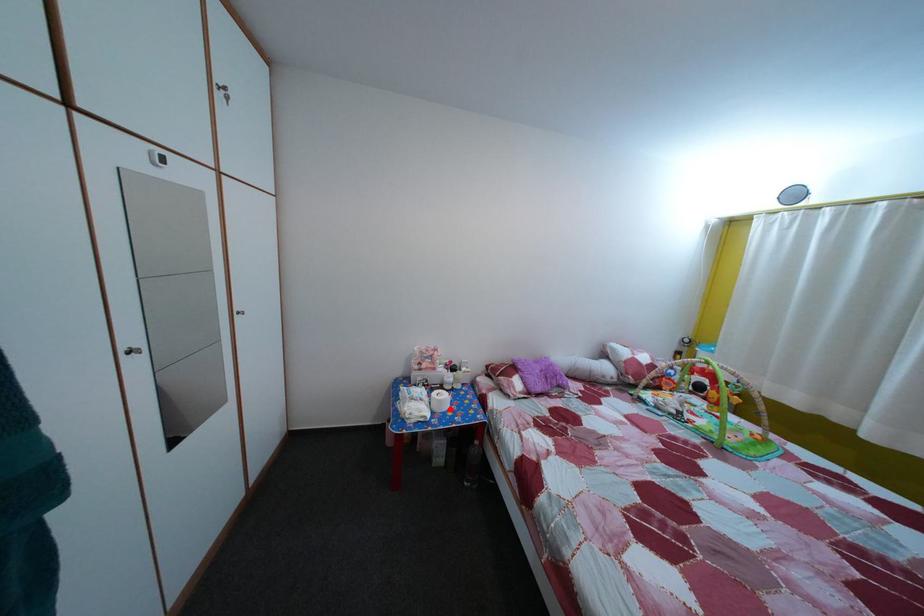
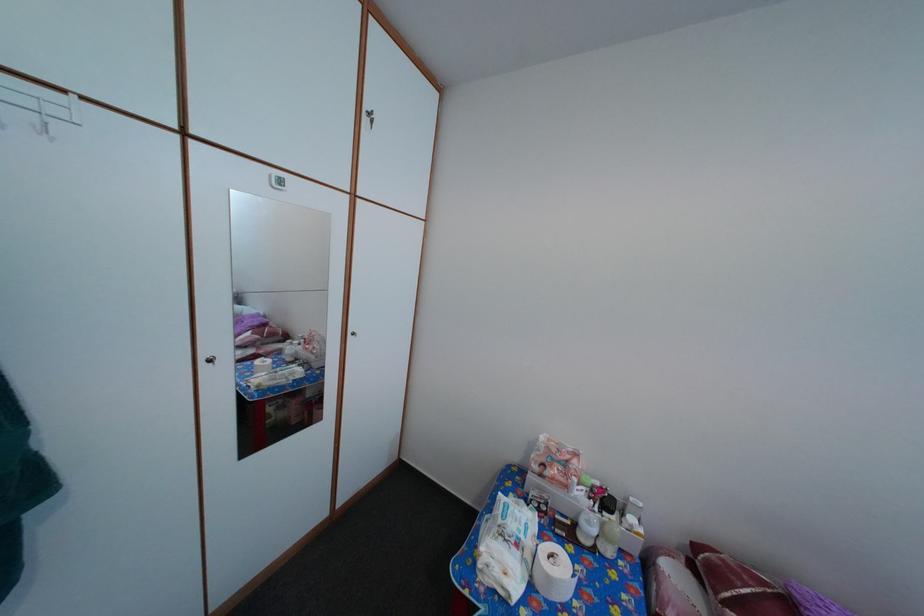
In the second image, find the point that corresponds to the highlighted location in the first image.

(558, 586)